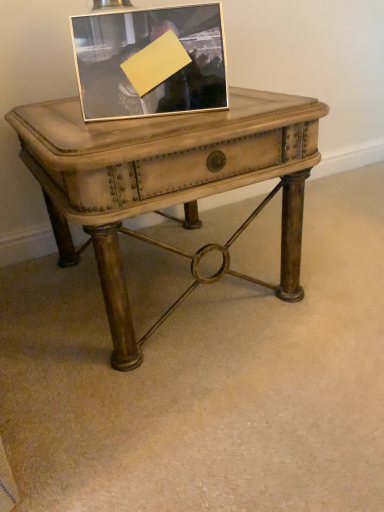
Question: Which direction should I rotate to look at silver metallic picture frame at upper center?

Choices:
 (A) right
 (B) left

Answer: (B)

Question: Can we say matte wood table at center lies outside silver metallic picture frame at upper center?

Choices:
 (A) no
 (B) yes

Answer: (B)

Question: Is matte wood table at center facing towards silver metallic picture frame at upper center?

Choices:
 (A) yes
 (B) no

Answer: (B)

Question: Considering the relative sizes of matte wood table at center and silver metallic picture frame at upper center in the image provided, is matte wood table at center bigger than silver metallic picture frame at upper center?

Choices:
 (A) yes
 (B) no

Answer: (A)

Question: Is silver metallic picture frame at upper center completely or partially inside matte wood table at center?

Choices:
 (A) no
 (B) yes

Answer: (A)

Question: Considering the relative positions of matte wood table at center and silver metallic picture frame at upper center in the image provided, is matte wood table at center to the left of silver metallic picture frame at upper center from the viewer's perspective?

Choices:
 (A) yes
 (B) no

Answer: (B)

Question: Is matte wood table at center smaller than silver metallic picture frame at upper center?

Choices:
 (A) no
 (B) yes

Answer: (A)

Question: Is matte wood table at center at the back of silver metallic picture frame at upper center?

Choices:
 (A) yes
 (B) no

Answer: (B)

Question: Considering the relative sizes of silver metallic picture frame at upper center and matte wood table at center in the image provided, is silver metallic picture frame at upper center thinner than matte wood table at center?

Choices:
 (A) no
 (B) yes

Answer: (B)

Question: From a real-world perspective, is silver metallic picture frame at upper center located higher than matte wood table at center?

Choices:
 (A) no
 (B) yes

Answer: (B)

Question: Can you confirm if silver metallic picture frame at upper center is wider than matte wood table at center?

Choices:
 (A) yes
 (B) no

Answer: (B)

Question: Is silver metallic picture frame at upper center at the left side of matte wood table at center?

Choices:
 (A) no
 (B) yes

Answer: (B)

Question: Is silver metallic picture frame at upper center far away from matte wood table at center?

Choices:
 (A) yes
 (B) no

Answer: (B)

Question: Is matte wood table at center taller or shorter than silver metallic picture frame at upper center?

Choices:
 (A) short
 (B) tall

Answer: (B)